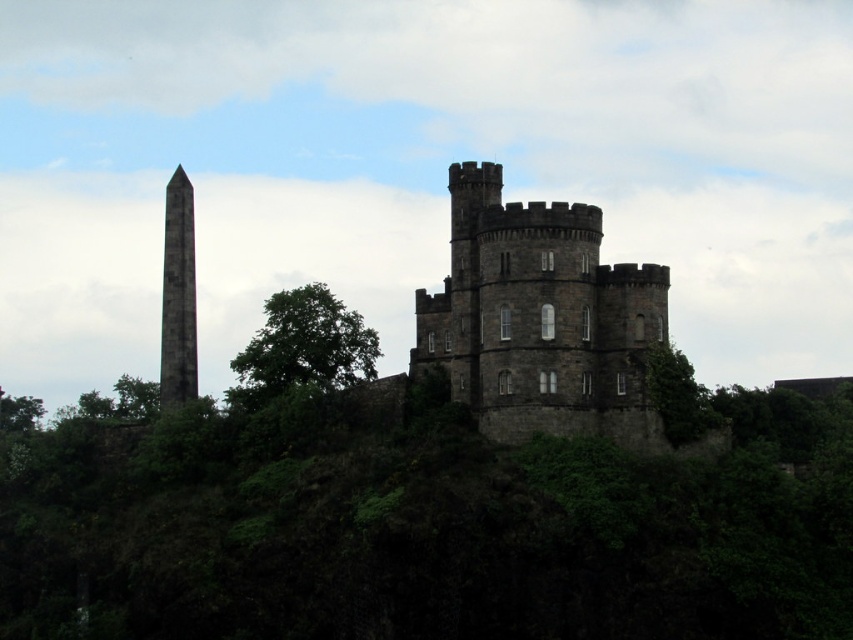
You are a tourist standing at the base of the historic stone structure. You want to take a photo that includes both the green leafy tree at center and the tall, slender obelisk mentioned in the scene. However, your camera has a maximum zoom range of 100 feet. Can you capture both objects in a single frame without moving your position?

The green leafy tree at center is 327.03 feet away from the camera, which exceeds the camera maximum zoom range of 100 feet. Therefore, you cannot capture both objects in a single frame without moving your position.

You are a gardener planning to plant a new tree that requires at least 40 meters of space between it and any existing structures. Given the current distance between the granite obelisk at left and the green leafy tree at right, can you safely plant your new tree between them without violating the space requirement?

The distance between the granite obelisk at left and the green leafy tree at right is 44.69 meters, which is more than the required 40 meters. Therefore, you can safely plant the new tree between them while maintaining the necessary space.